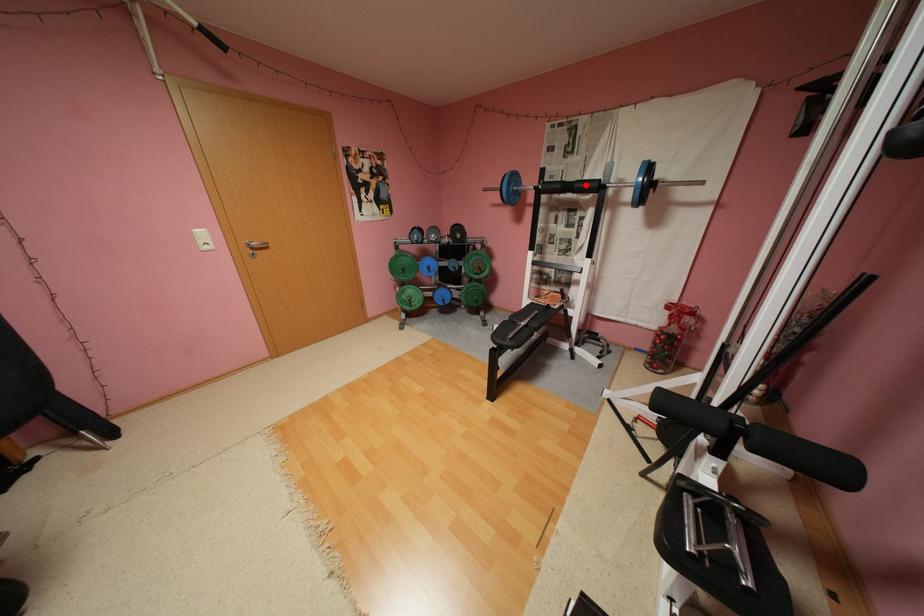
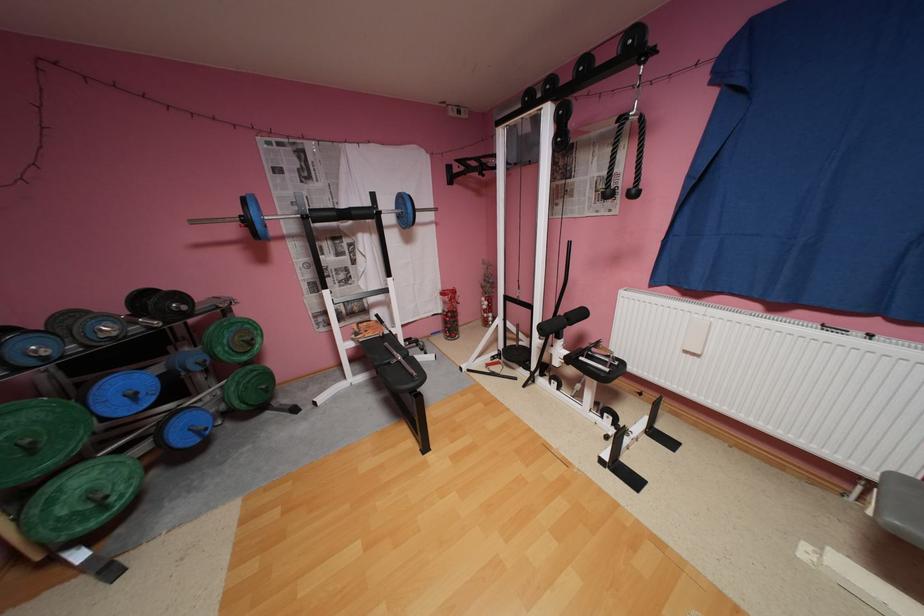
Where in the second image is the point corresponding to the highlighted location from the first image?

(362, 213)